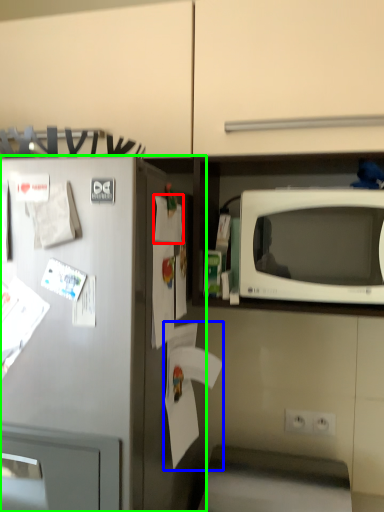
Question: Based on their relative distances, which object is nearer to paper (highlighted by a red box)? Choose from paper (highlighted by a blue box) and refrigerator (highlighted by a green box).

Choices:
 (A) paper
 (B) refrigerator

Answer: (B)